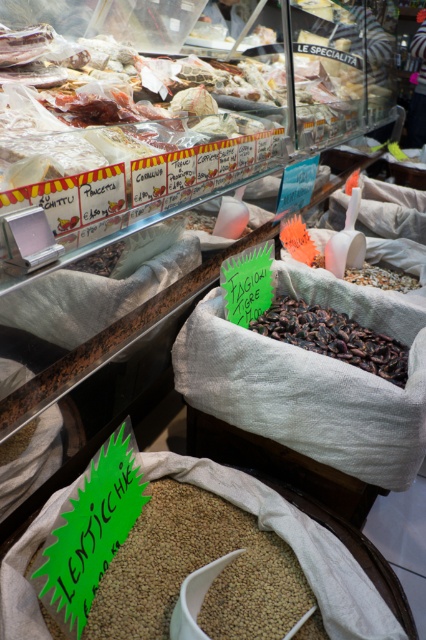
Question: Which point is farther to the camera?

Choices:
 (A) pyautogui.click(x=48, y=625)
 (B) pyautogui.click(x=394, y=348)

Answer: (B)

Question: Does brown matte lentils at center have a greater width compared to dark brown grain at center?

Choices:
 (A) no
 (B) yes

Answer: (B)

Question: Which object is farther from the camera taking this photo?

Choices:
 (A) brown matte lentils at center
 (B) dark brown grain at center

Answer: (B)

Question: Observing the image, what is the correct spatial positioning of brown matte lentils at center in reference to dark brown grain at center?

Choices:
 (A) left
 (B) right

Answer: (A)

Question: Is brown matte lentils at center thinner than dark brown grain at center?

Choices:
 (A) yes
 (B) no

Answer: (B)